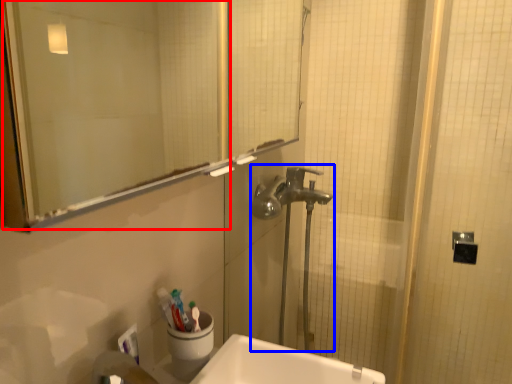
Question: Among these objects, which one is nearest to the camera, mirror (highlighted by a red box) or plumbing fixture (highlighted by a blue box)?

Choices:
 (A) mirror
 (B) plumbing fixture

Answer: (A)